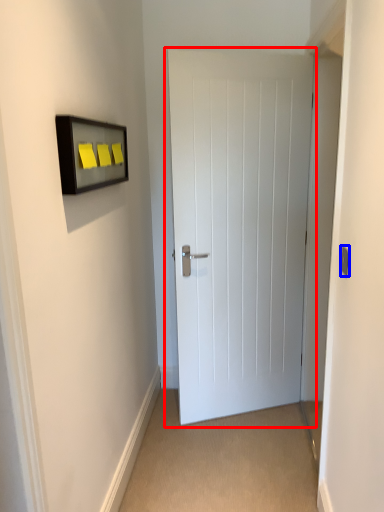
Question: Among these objects, which one is farthest to the camera, door (highlighted by a red box) or light switch (highlighted by a blue box)?

Choices:
 (A) door
 (B) light switch

Answer: (A)